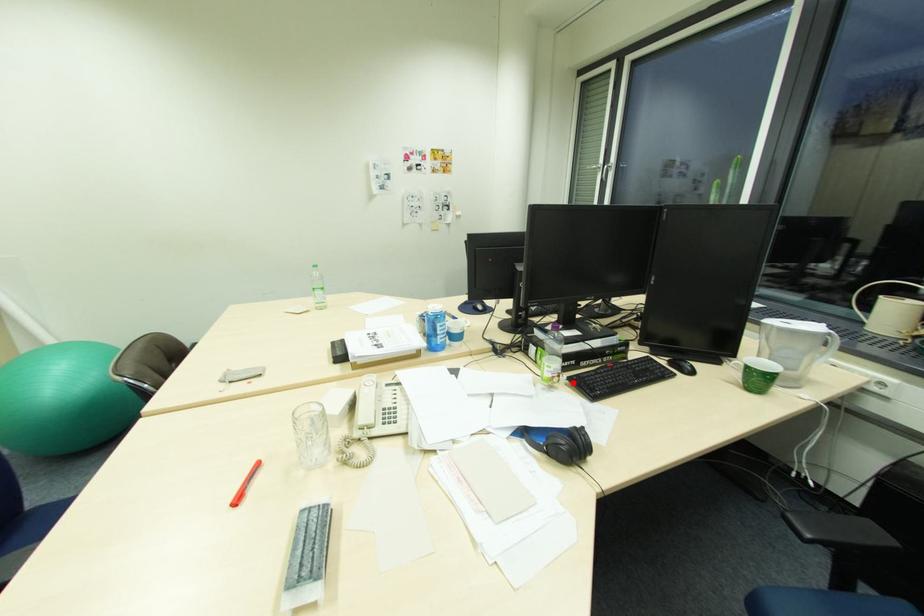
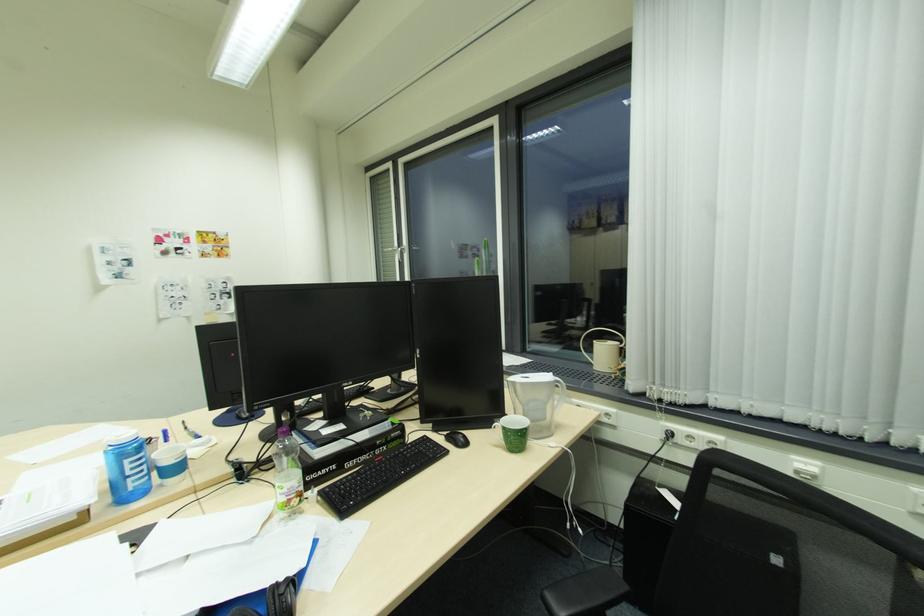
Find the pixel in the second image that matches the highlighted location in the first image.

(324, 499)